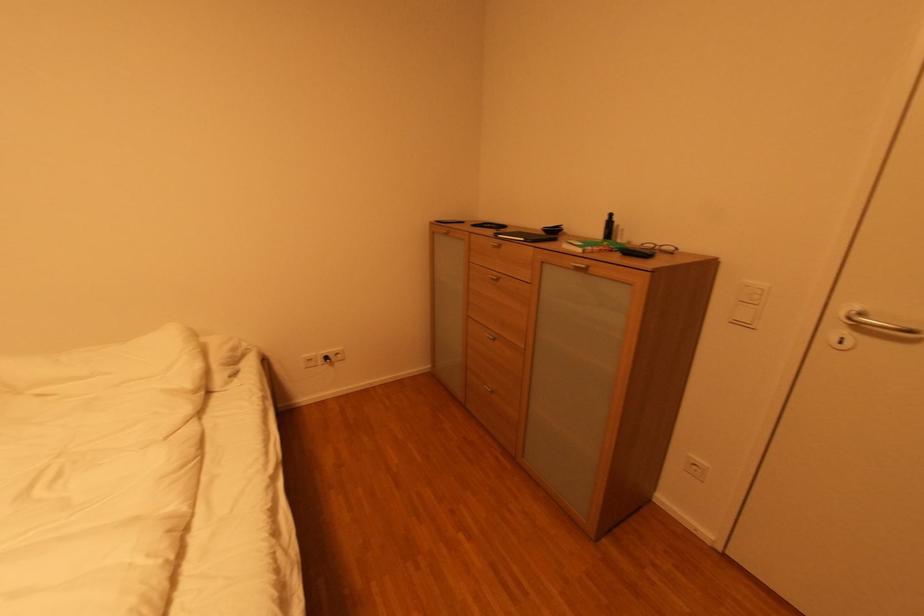
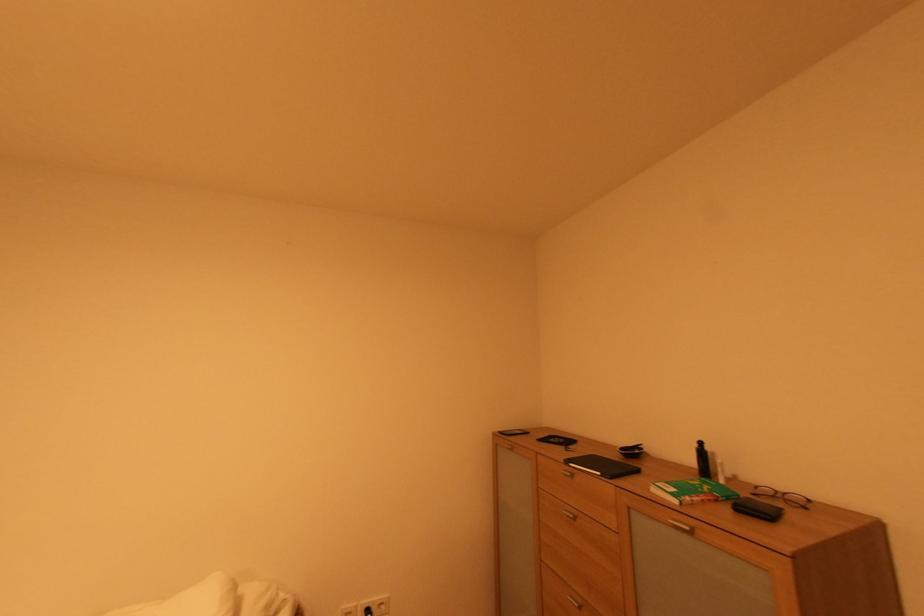
The point at (613, 219) is marked in the first image. Where is the corresponding point in the second image?

(701, 447)